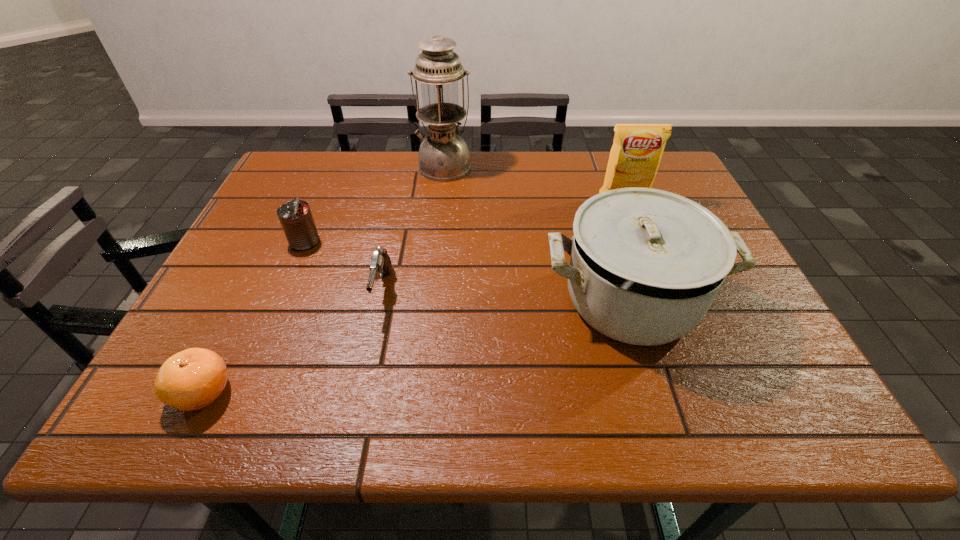
At what (x,y) coordinates should I click in order to perform the action: click on oil lamp. Please return your answer as a coordinate pair (x, y). Looking at the image, I should click on (443, 156).

Where is `the fourth object from left to right`? the fourth object from left to right is located at coordinates (443, 156).

Where is `crisp (potato chip)`? crisp (potato chip) is located at coordinates (637, 149).

What are the coordinates of `saucepan` in the screenshot? It's located at (646, 264).

Find the location of a particular element. The width and height of the screenshot is (960, 540). can is located at coordinates (295, 216).

This screenshot has height=540, width=960. Identify the location of the fourth tallest object. (295, 216).

Find the location of a particular element. pistol is located at coordinates (380, 264).

Where is `the third object from left to right`? the third object from left to right is located at coordinates (380, 264).

Where is `the shortest object`? Image resolution: width=960 pixels, height=540 pixels. the shortest object is located at coordinates (192, 379).

Where is `clementine`? clementine is located at coordinates (192, 379).